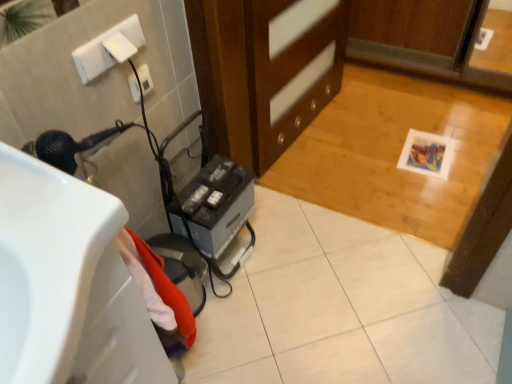
Question: Does wooden cabinet at center appear on the right side of white plastic electric outlet at upper left?

Choices:
 (A) yes
 (B) no

Answer: (A)

Question: Is there a large distance between wooden cabinet at center and white plastic electric outlet at upper left?

Choices:
 (A) yes
 (B) no

Answer: (B)

Question: Can you confirm if wooden cabinet at center is shorter than white plastic electric outlet at upper left?

Choices:
 (A) yes
 (B) no

Answer: (B)

Question: From a real-world perspective, is wooden cabinet at center located beneath white plastic electric outlet at upper left?

Choices:
 (A) yes
 (B) no

Answer: (A)

Question: From the image's perspective, does wooden cabinet at center appear higher than white plastic electric outlet at upper left?

Choices:
 (A) yes
 (B) no

Answer: (A)

Question: From a real-world perspective, relative to metallic gray hair dryer at lower left, is white glossy sink at lower left vertically above or below?

Choices:
 (A) below
 (B) above

Answer: (B)

Question: Based on their sizes in the image, would you say white glossy sink at lower left is bigger or smaller than metallic gray hair dryer at lower left?

Choices:
 (A) small
 (B) big

Answer: (B)

Question: Based on their positions, is white glossy sink at lower left located to the left or right of metallic gray hair dryer at lower left?

Choices:
 (A) left
 (B) right

Answer: (A)

Question: Is white glossy sink at lower left wider or thinner than metallic gray hair dryer at lower left?

Choices:
 (A) wide
 (B) thin

Answer: (A)

Question: Would you say wooden cabinet at center is to the left or to the right of metallic gray hair dryer at lower left in the picture?

Choices:
 (A) left
 (B) right

Answer: (B)

Question: Is wooden cabinet at center inside the boundaries of metallic gray hair dryer at lower left, or outside?

Choices:
 (A) outside
 (B) inside

Answer: (A)

Question: In the image, is wooden cabinet at center positioned in front of or behind metallic gray hair dryer at lower left?

Choices:
 (A) behind
 (B) front

Answer: (A)

Question: In terms of size, does wooden cabinet at center appear bigger or smaller than metallic gray hair dryer at lower left?

Choices:
 (A) small
 (B) big

Answer: (B)

Question: From a real-world perspective, is white glossy sink at lower left physically located above or below white plastic electric outlet at upper left?

Choices:
 (A) below
 (B) above

Answer: (B)

Question: From the image's perspective, is white glossy sink at lower left located above or below white plastic electric outlet at upper left?

Choices:
 (A) below
 (B) above

Answer: (A)